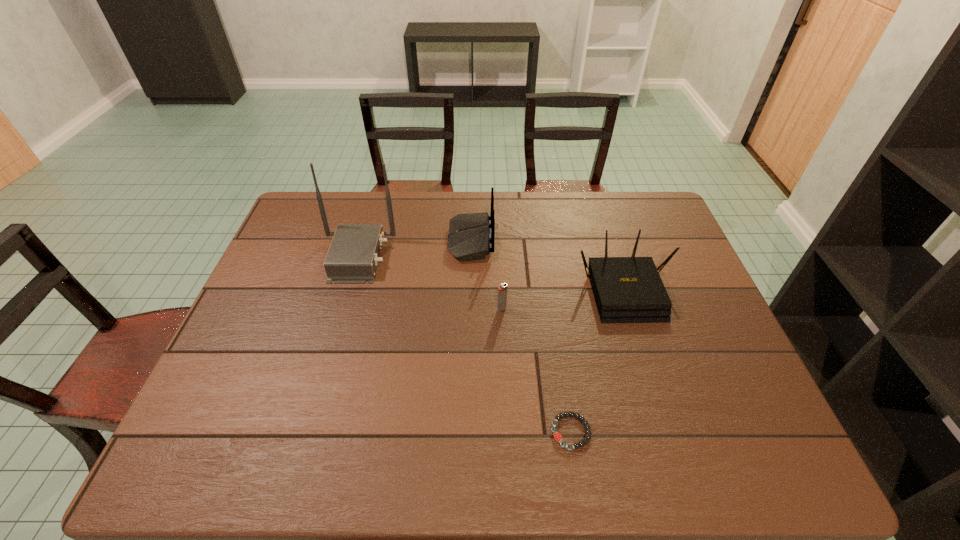
Where is `the tallest object`? The image size is (960, 540). the tallest object is located at coordinates (353, 256).

Locate an element on the screen. the leftmost object is located at coordinates (353, 256).

I want to click on the second object from left to right, so click(469, 239).

Find the location of a particular element. the second router from left to right is located at coordinates (469, 239).

Locate an element on the screen. the rightmost router is located at coordinates (626, 289).

The height and width of the screenshot is (540, 960). I want to click on the rightmost object, so 626,289.

Where is `igniter`? igniter is located at coordinates (502, 290).

The image size is (960, 540). What are the coordinates of `the third object from right to left` in the screenshot? It's located at (502, 290).

Identify the location of bracelet. click(x=557, y=436).

Locate an element on the screen. This screenshot has height=540, width=960. the shortest object is located at coordinates (557, 436).